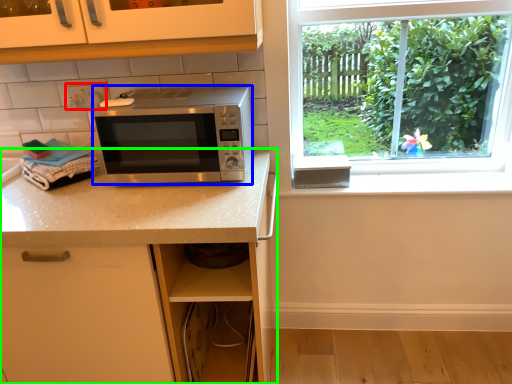
Question: Which object is positioned closest to electric outlet (highlighted by a red box)? Select from microwave oven (highlighted by a blue box) and countertop (highlighted by a green box).

Choices:
 (A) microwave oven
 (B) countertop

Answer: (A)